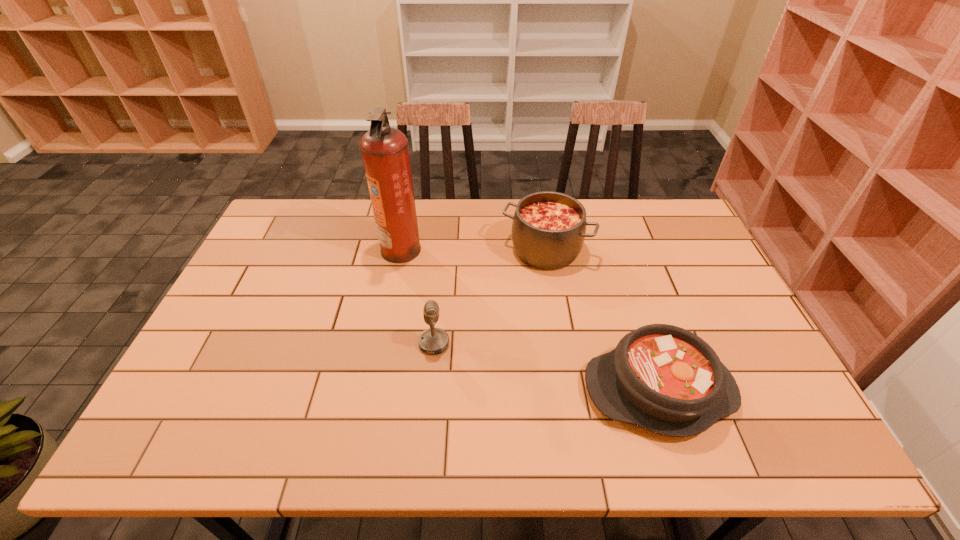
The image size is (960, 540). I want to click on vacant space in between the second object from left to right and the taller casserole, so click(490, 296).

This screenshot has width=960, height=540. I want to click on free point between the farther casserole and the fire extinguisher, so click(x=473, y=249).

The width and height of the screenshot is (960, 540). Find the location of `vacant area between the farther casserole and the shortest object`. vacant area between the farther casserole and the shortest object is located at coordinates (602, 320).

Image resolution: width=960 pixels, height=540 pixels. Identify the location of free space between the farther casserole and the microphone. (490, 296).

What are the coordinates of `vacant space that's between the farther casserole and the shorter casserole` in the screenshot? It's located at (602, 320).

Where is `free space between the shorter casserole and the second object from left to right`? Image resolution: width=960 pixels, height=540 pixels. free space between the shorter casserole and the second object from left to right is located at coordinates (546, 367).

At what (x,y) coordinates should I click in order to perform the action: click on blank region between the tallest object and the shorter casserole. Please return your answer as a coordinate pair (x, y). This screenshot has height=540, width=960. Looking at the image, I should click on (530, 320).

Locate an element on the screen. The height and width of the screenshot is (540, 960). vacant space in between the microphone and the tallest object is located at coordinates (418, 296).

At what (x,y) coordinates should I click in order to perform the action: click on free space between the shorter casserole and the farther casserole. Please return your answer as a coordinate pair (x, y). Looking at the image, I should click on (602, 320).

I want to click on vacant space in between the shorter casserole and the taller casserole, so (x=602, y=320).